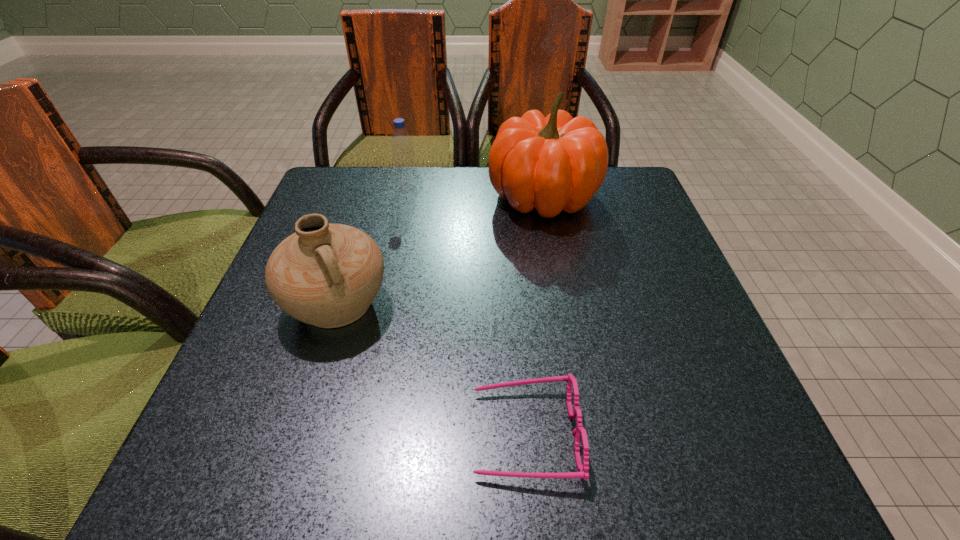
Identify which object is the second closest to the nearest object. Please provide its 2D coordinates. Your answer should be formatted as a tuple, i.e. [(x, y)], where the tuple contains the x and y coordinates of a point satisfying the conditions above.

[(553, 163)]

Where is `blank space that satisfies the following two spatial constraints: 1. on the front side of the bottle; 2. on the left side of the tallest object`? The width and height of the screenshot is (960, 540). blank space that satisfies the following two spatial constraints: 1. on the front side of the bottle; 2. on the left side of the tallest object is located at coordinates (406, 197).

At what (x,y) coordinates should I click in order to perform the action: click on vacant area that satisfies the following two spatial constraints: 1. on the back side of the pottery; 2. on the right side of the bottle. Please return your answer as a coordinate pair (x, y). Image resolution: width=960 pixels, height=540 pixels. Looking at the image, I should click on (374, 188).